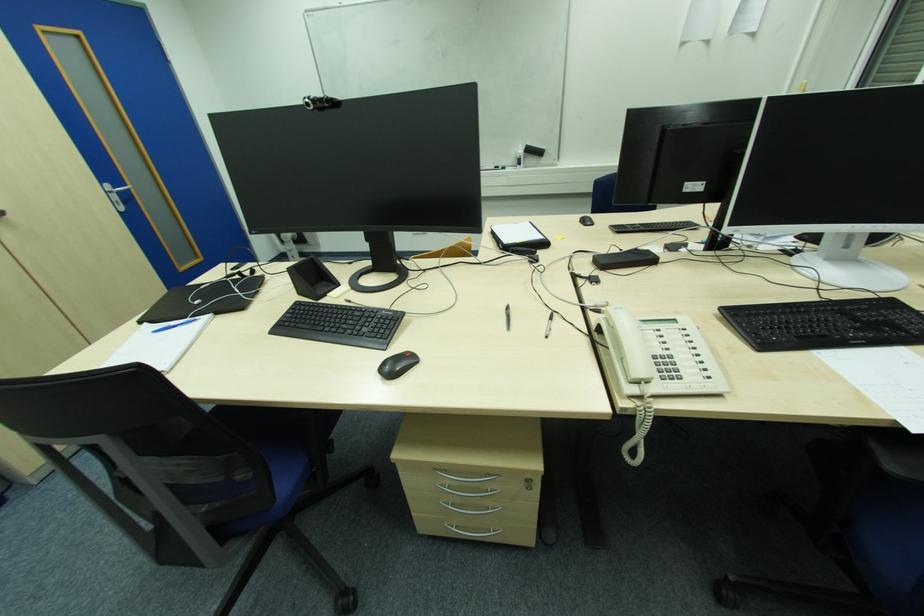
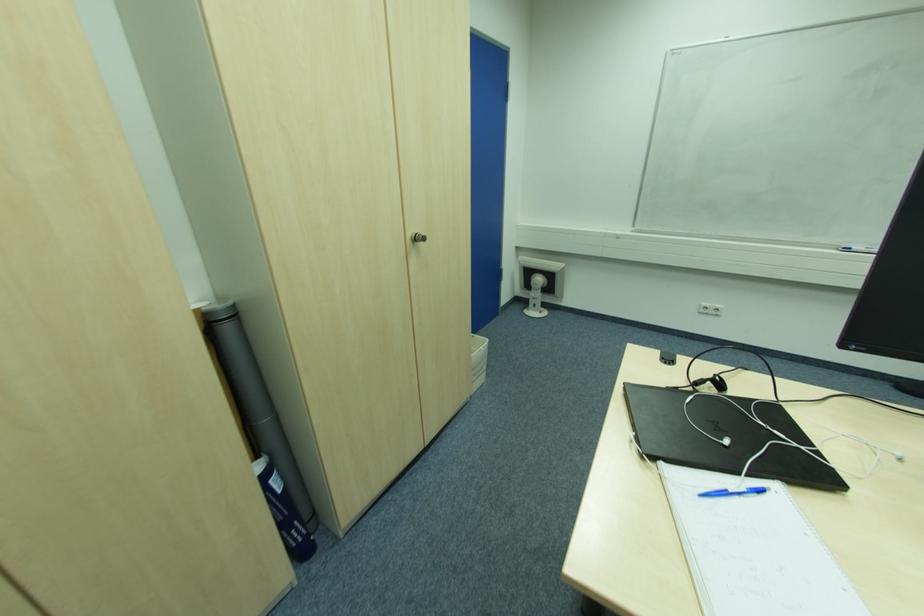
Find the pixel in the second image that matches pixel 199 302 in the first image.

(728, 443)